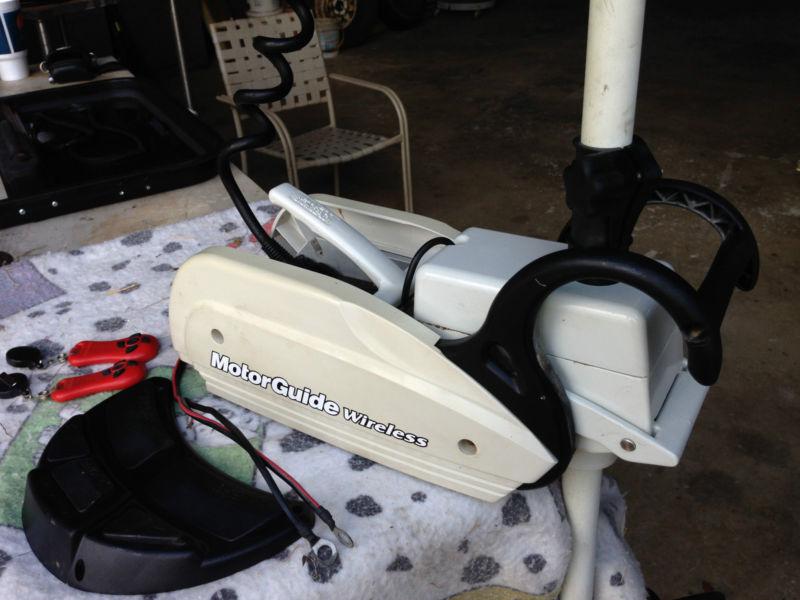
Where is `right side arm rest on chair`? This screenshot has height=600, width=800. right side arm rest on chair is located at coordinates (x=278, y=124).